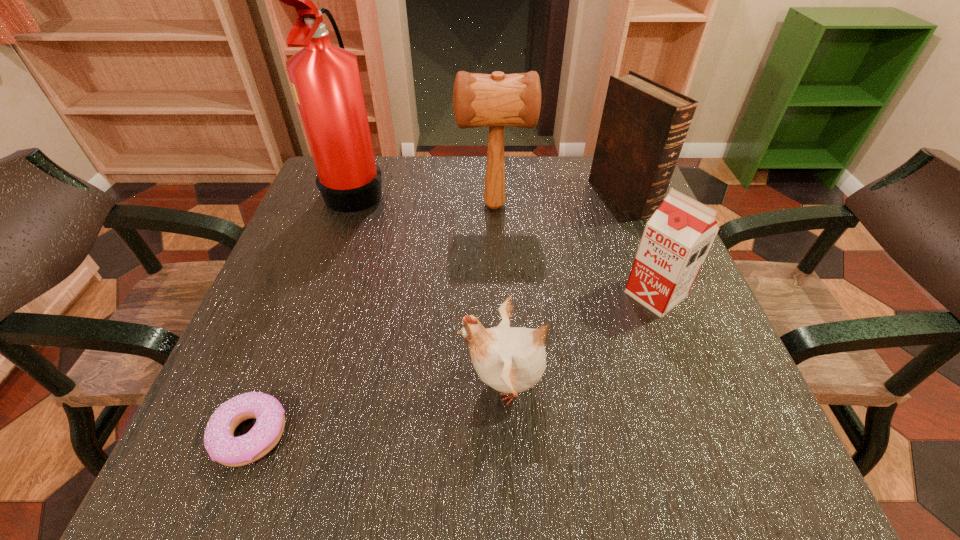
I want to click on bird at the near edge, so click(511, 360).

Image resolution: width=960 pixels, height=540 pixels. What are the coordinates of `doughnut at the near edge` in the screenshot? It's located at (220, 443).

Where is `fire extinguisher at the left edge`? This screenshot has height=540, width=960. fire extinguisher at the left edge is located at coordinates (x=326, y=81).

Locate an element on the screen. The width and height of the screenshot is (960, 540). doughnut at the left edge is located at coordinates (220, 443).

Where is `Bible present at the right edge`? Bible present at the right edge is located at coordinates (644, 124).

At what (x,y) coordinates should I click in order to perform the action: click on soya milk positioned at the right edge. Please return your answer as a coordinate pair (x, y). This screenshot has width=960, height=540. Looking at the image, I should click on (677, 238).

Where is `object that is positioned at the far left corner`? object that is positioned at the far left corner is located at coordinates (326, 81).

Where is `object present at the near left corner`? The height and width of the screenshot is (540, 960). object present at the near left corner is located at coordinates (220, 443).

Identify the location of object present at the far right corner. The height and width of the screenshot is (540, 960). (644, 124).

Where is `vacant position at the far edge of the desktop`? The image size is (960, 540). vacant position at the far edge of the desktop is located at coordinates (533, 206).